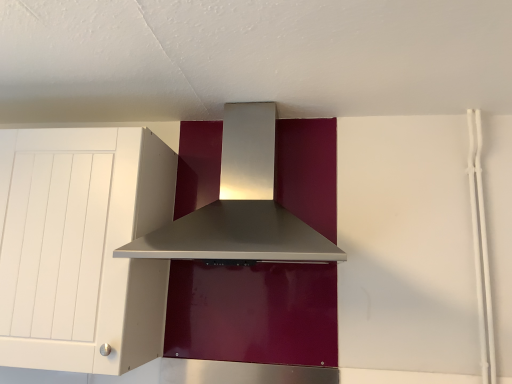
Question: In terms of width, does white matte cabinet at left look wider or thinner when compared to satin silver range hood at center?

Choices:
 (A) wide
 (B) thin

Answer: (B)

Question: Is white matte cabinet at left taller or shorter than satin silver range hood at center?

Choices:
 (A) short
 (B) tall

Answer: (B)

Question: Relative to satin silver range hood at center, is white matte cabinet at left in front or behind?

Choices:
 (A) behind
 (B) front

Answer: (A)

Question: From the image's perspective, is satin silver range hood at center located above or below white matte cabinet at left?

Choices:
 (A) above
 (B) below

Answer: (A)

Question: Considering the positions of point (166, 228) and point (128, 286), is point (166, 228) closer or farther from the camera than point (128, 286)?

Choices:
 (A) farther
 (B) closer

Answer: (A)

Question: From their relative heights in the image, would you say satin silver range hood at center is taller or shorter than white matte cabinet at left?

Choices:
 (A) short
 (B) tall

Answer: (A)

Question: Based on their positions, is satin silver range hood at center located to the left or right of white matte cabinet at left?

Choices:
 (A) right
 (B) left

Answer: (A)